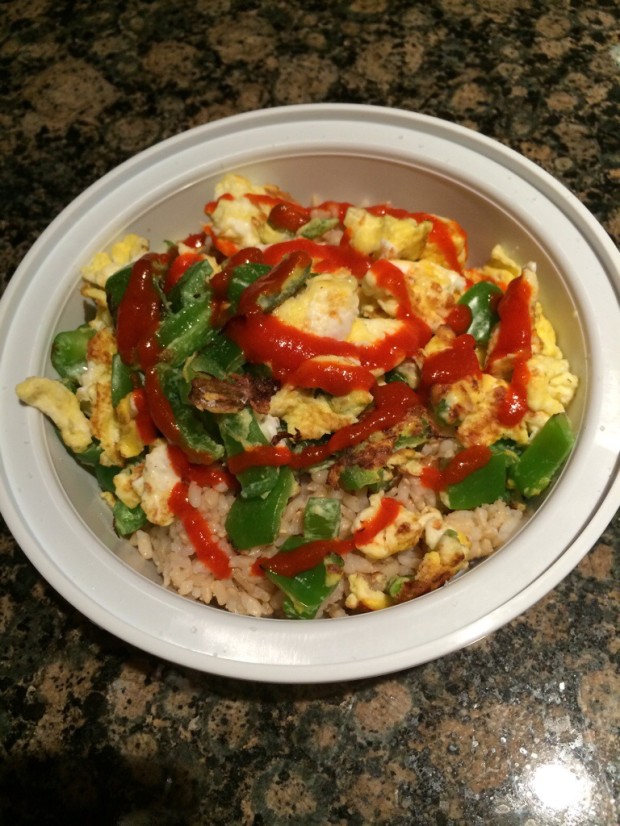
In order to click on bowl in this screenshot , I will do `click(170, 183)`.